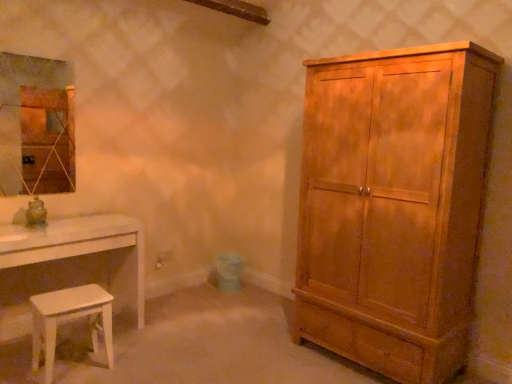
Question: Can you confirm if white glossy table at lower left is thinner than white glossy stool at lower left?

Choices:
 (A) no
 (B) yes

Answer: (A)

Question: Is white glossy stool at lower left completely or partially inside white glossy table at lower left?

Choices:
 (A) no
 (B) yes

Answer: (A)

Question: Is white glossy table at lower left further to the viewer compared to white glossy stool at lower left?

Choices:
 (A) no
 (B) yes

Answer: (B)

Question: From a real-world perspective, is white glossy table at lower left under white glossy stool at lower left?

Choices:
 (A) yes
 (B) no

Answer: (B)

Question: Is white glossy table at lower left turned away from white glossy stool at lower left?

Choices:
 (A) no
 (B) yes

Answer: (A)

Question: Would you say white glossy stool at lower left is to the left or to the right of matte glass mirror at upper left in the picture?

Choices:
 (A) right
 (B) left

Answer: (A)

Question: Is point (104, 342) closer or farther from the camera than point (42, 79)?

Choices:
 (A) closer
 (B) farther

Answer: (A)

Question: Looking at their shapes, would you say white glossy stool at lower left is wider or thinner than matte glass mirror at upper left?

Choices:
 (A) thin
 (B) wide

Answer: (B)

Question: From their relative heights in the image, would you say white glossy stool at lower left is taller or shorter than matte glass mirror at upper left?

Choices:
 (A) tall
 (B) short

Answer: (B)

Question: Is matte glass mirror at upper left inside the boundaries of matte wood cabinet at right, or outside?

Choices:
 (A) outside
 (B) inside

Answer: (A)

Question: Is point (62, 168) positioned closer to the camera than point (336, 339)?

Choices:
 (A) farther
 (B) closer

Answer: (A)

Question: Is matte glass mirror at upper left wider or thinner than matte wood cabinet at right?

Choices:
 (A) wide
 (B) thin

Answer: (B)

Question: From the image's perspective, is matte glass mirror at upper left above or below matte wood cabinet at right?

Choices:
 (A) below
 (B) above

Answer: (B)

Question: From a real-world perspective, is matte wood cabinet at right positioned above or below white glossy table at lower left?

Choices:
 (A) above
 (B) below

Answer: (A)

Question: Considering the positions of matte wood cabinet at right and white glossy table at lower left in the image, is matte wood cabinet at right taller or shorter than white glossy table at lower left?

Choices:
 (A) short
 (B) tall

Answer: (B)